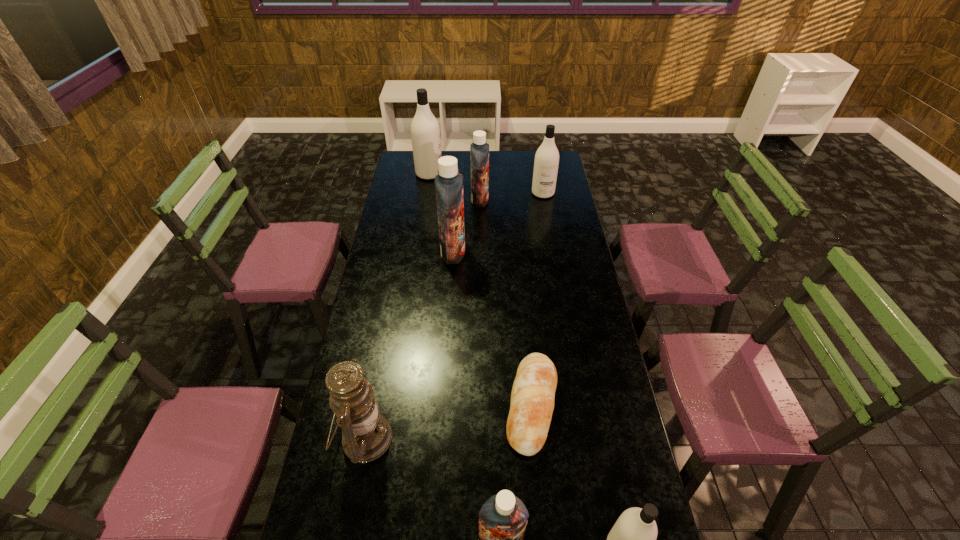
What are the coordinates of `the farthest object` in the screenshot? It's located at pos(425,132).

You are a GUI agent. You are given a task and a screenshot of the screen. Output one action in this format:
    pyautogui.click(x=<x>, y=<y>)
    Task: Click on the leftmost shampoo
    
    Given the screenshot: What is the action you would take?
    pyautogui.click(x=425, y=132)

At what (x,y) coordinates should I click in order to perform the action: click on the sixth object from right to left. Please return your answer as a coordinate pair (x, y). The height and width of the screenshot is (540, 960). Looking at the image, I should click on (448, 182).

Locate an element on the screen. The height and width of the screenshot is (540, 960). the second shampoo from left to right is located at coordinates (448, 182).

This screenshot has height=540, width=960. Find the location of `the second smallest blue shampoo`. the second smallest blue shampoo is located at coordinates (479, 150).

At what (x,y) coordinates should I click in order to perform the action: click on the second nearest white shampoo. Please return your answer as a coordinate pair (x, y). Looking at the image, I should click on (546, 162).

Where is `oil lamp`? oil lamp is located at coordinates (366, 435).

At what (x,y) coordinates should I click in order to perform the action: click on bread. Please return your answer as a coordinate pair (x, y). The height and width of the screenshot is (540, 960). Looking at the image, I should click on [x=532, y=398].

Image resolution: width=960 pixels, height=540 pixels. What are the coordinates of `beige bread` in the screenshot? It's located at (532, 398).

Where is `free spot located on the front-facing side of the farthest shampoo`? The image size is (960, 540). free spot located on the front-facing side of the farthest shampoo is located at coordinates (452, 174).